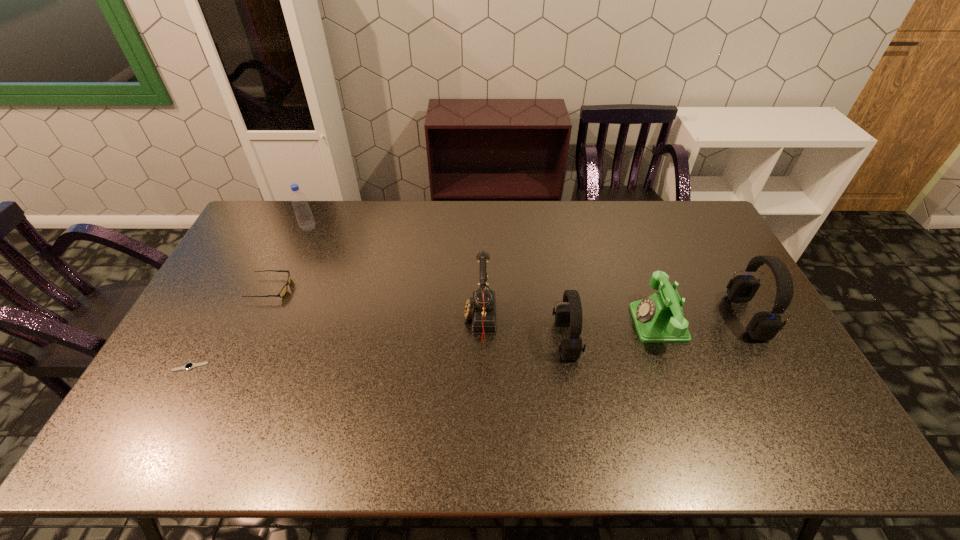
I want to click on free region at the near edge of the desktop, so [688, 397].

Locate an element on the screen. This screenshot has width=960, height=540. free point at the left edge is located at coordinates (195, 358).

Identify the location of free space at the right edge of the desktop. This screenshot has width=960, height=540. (781, 370).

Locate an element on the screen. This screenshot has width=960, height=540. free space at the near right corner of the desktop is located at coordinates (755, 393).

Image resolution: width=960 pixels, height=540 pixels. What are the coordinates of `vacant area between the farthest object and the taller headset` in the screenshot? It's located at (528, 272).

Identify the location of blank region between the leftmost object and the shorter telephone. (424, 345).

Locate an element on the screen. unoccupied position between the second object from right to left and the sunglasses is located at coordinates (x=465, y=306).

At what (x,y) coordinates should I click in order to perform the action: click on free space between the taller headset and the leftmost object. Please return your answer as a coordinate pair (x, y). The height and width of the screenshot is (540, 960). Looking at the image, I should click on (468, 342).

You are a GUI agent. You are given a task and a screenshot of the screen. Output one action in this format:
    pyautogui.click(x=<x>, y=<y>)
    Task: Click on the unoccupied area between the taller headset and the farthest object
    The width and height of the screenshot is (960, 540).
    Given the screenshot: What is the action you would take?
    pyautogui.click(x=528, y=272)

Identify the location of unoccupied position between the left headset and the shortest object. This screenshot has height=540, width=960. (378, 353).